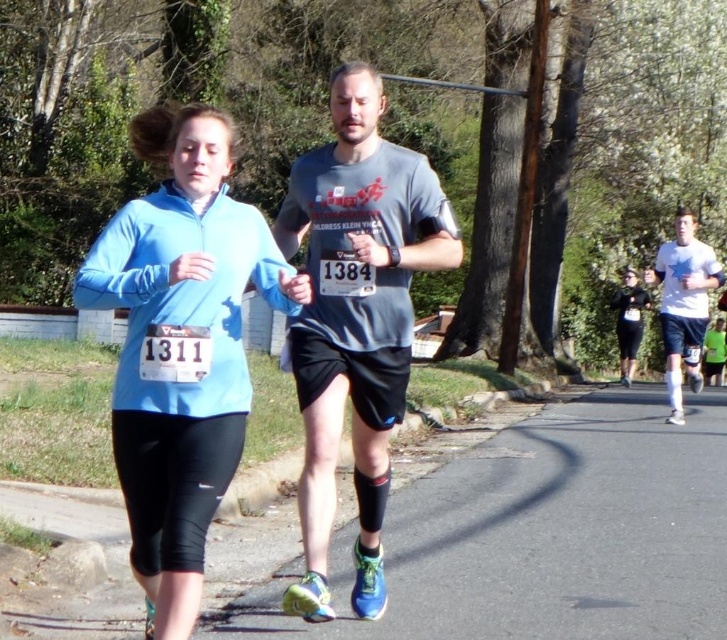
Find the location of a particular element. matte blue jacket at center is located at coordinates (180, 346).

Is matte blue jacket at center bigger than black matte leggings at center?

No, matte blue jacket at center is not bigger than black matte leggings at center.

Image resolution: width=727 pixels, height=640 pixels. I want to click on matte blue jacket at center, so click(180, 346).

Does point (702, 326) come in front of point (630, 356)?

Yes, it is in front of point (630, 356).

Who is more distant from viewer, (699, 296) or (640, 330)?

Positioned behind is point (640, 330).

Find the location of a particular element. The width and height of the screenshot is (727, 640). white matte t-shirt at center is located at coordinates (683, 305).

Is matte blue jacket at center bigger than white matte t-shirt at center?

Actually, matte blue jacket at center might be smaller than white matte t-shirt at center.

Which is more to the right, matte blue jacket at center or white matte t-shirt at center?

white matte t-shirt at center is more to the right.

Which is behind, point (166, 108) or point (694, 308)?

The point (166, 108) is more distant.

The image size is (727, 640). Identify the location of matte blue jacket at center. (180, 346).